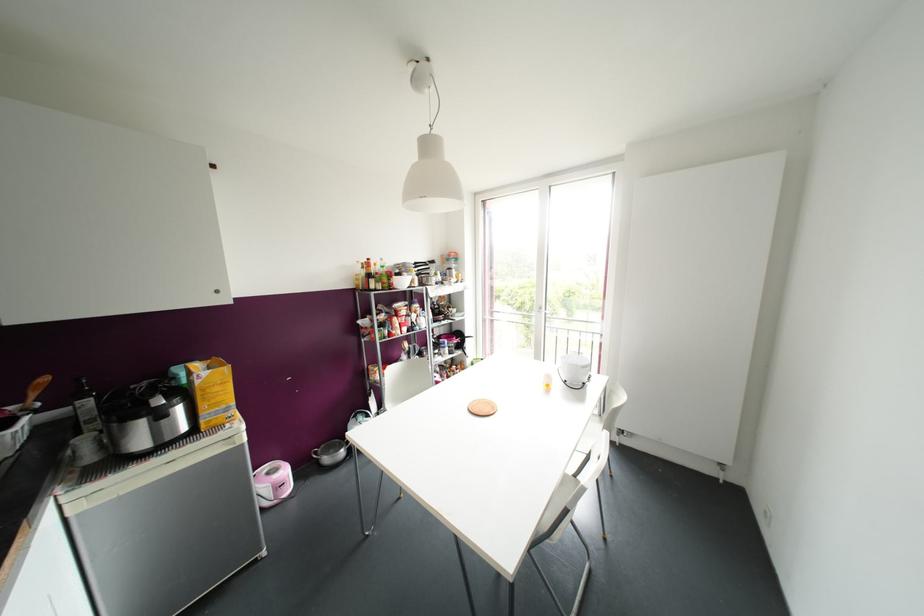
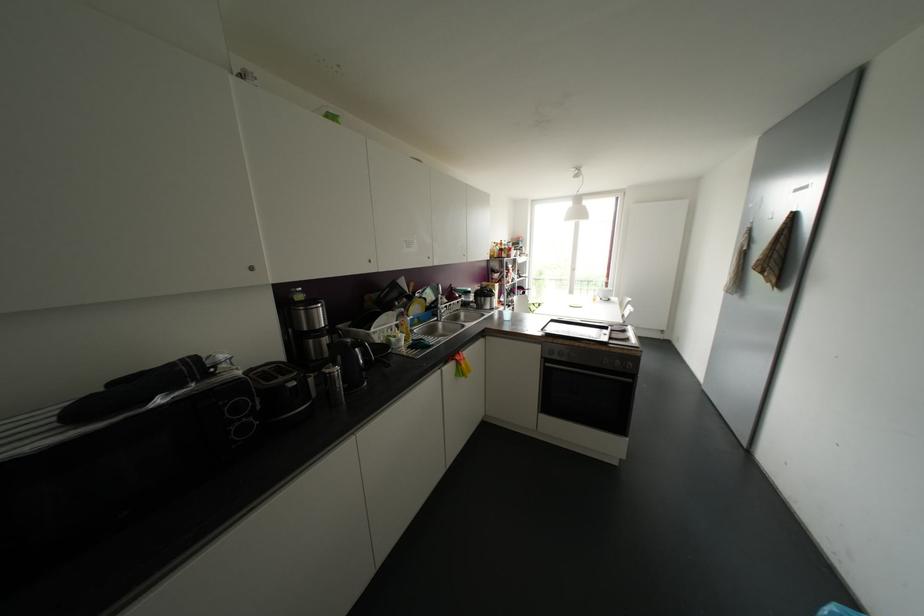
Looking at this image, what movement of the cameraman would produce the second image?

The cameraman moved toward left, backward.